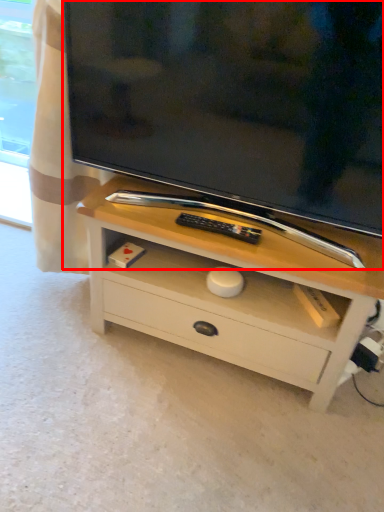
Question: From the image's perspective, what is the correct spatial positioning of television (annotated by the red box) in reference to chest of drawers?

Choices:
 (A) below
 (B) above

Answer: (B)